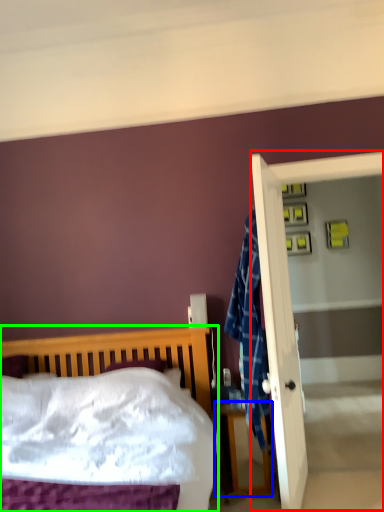
Question: Estimate the real-world distances between objects in this image. Which object is closer to screen door (highlighted by a red box), nightstand (highlighted by a blue box) or bed (highlighted by a green box)?

Choices:
 (A) nightstand
 (B) bed

Answer: (A)